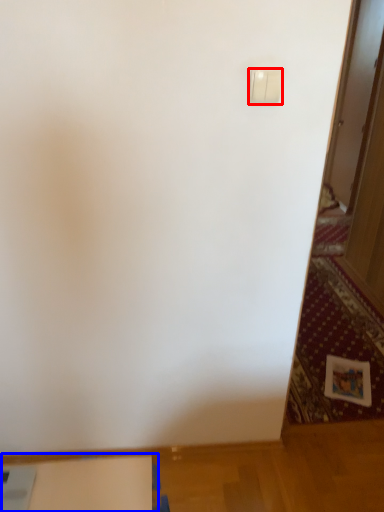
Question: Among these objects, which one is farthest to the camera, light switch (highlighted by a red box) or table (highlighted by a blue box)?

Choices:
 (A) light switch
 (B) table

Answer: (B)